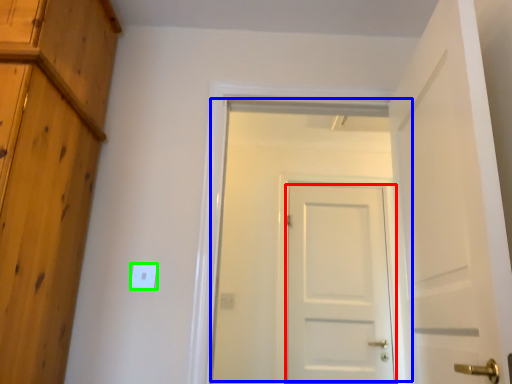
Question: Estimate the real-world distances between objects in this image. Which object is farther from door (highlighted by a red box), door (highlighted by a blue box) or light switch (highlighted by a green box)?

Choices:
 (A) door
 (B) light switch

Answer: (B)